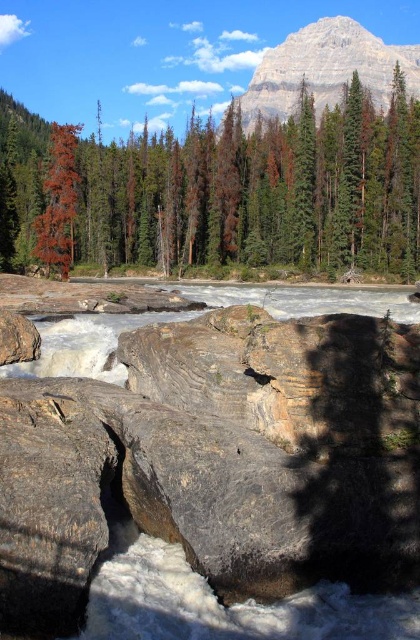
You are a hiker who wants to take a photo of the dead wood trees at upper left. Where exactly should you point your camera?

You should point your camera to point (x=259, y=192) to capture the dead wood trees at upper left.

You are standing at the edge of the river and want to take a photo. There are two points marked in the scene, point A at coordinates point (33,125) and point B at coordinates point (268,51). Which point will appear larger in your photo?

Point A at coordinates point (33,125) will appear larger in the photo because it is closer to the camera than point B at coordinates point (268,51).